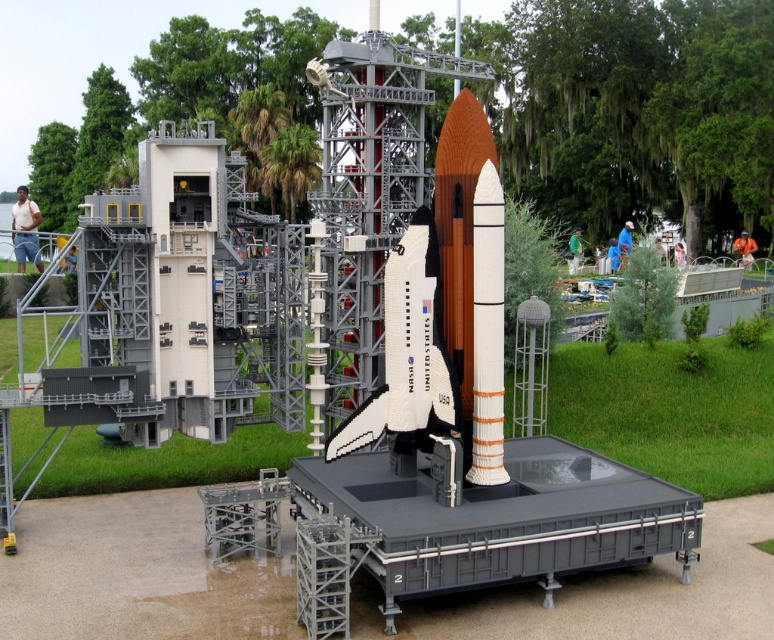
Question: Can you confirm if white plastic rocket at center is thinner than metallic gray lift at center?

Choices:
 (A) yes
 (B) no

Answer: (A)

Question: In this image, where is brick orange rocket at center located relative to white plastic rocket at center?

Choices:
 (A) below
 (B) above

Answer: (B)

Question: Which point is closer to the camera?

Choices:
 (A) metallic gray lift at center
 (B) brick orange rocket at center

Answer: (B)

Question: Which point appears closest to the camera in this image?

Choices:
 (A) (461, 269)
 (B) (378, 416)

Answer: (B)

Question: Among these points, which one is nearest to the camera?

Choices:
 (A) (406, 388)
 (B) (471, 300)
 (C) (699, 292)

Answer: (A)

Question: Is white plastic rocket at center wider than metallic gray lift at center?

Choices:
 (A) yes
 (B) no

Answer: (B)